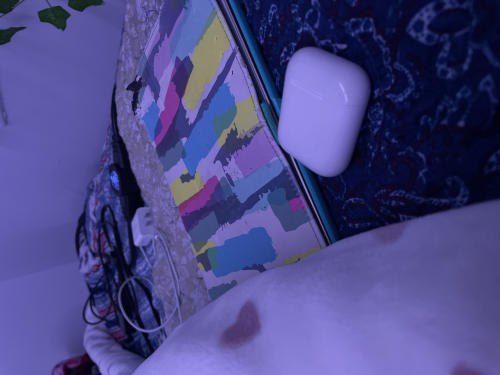
At what (x,y) coordinates should I click in order to perform the action: click on patterned bed cover. Please return your answer as a coordinate pair (x, y). The height and width of the screenshot is (375, 500). Looking at the image, I should click on (393, 181).